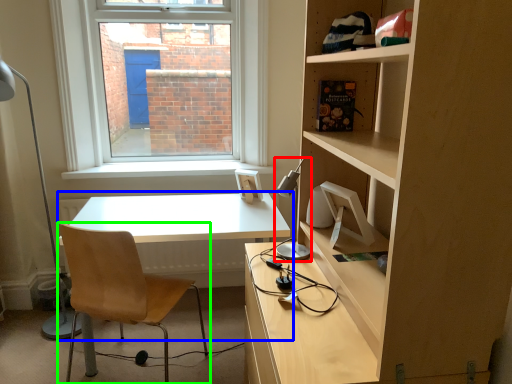
Question: Which object is the farthest from table lamp (highlighted by a red box)? Choose among these: table (highlighted by a blue box) or chair (highlighted by a green box).

Choices:
 (A) table
 (B) chair

Answer: (B)